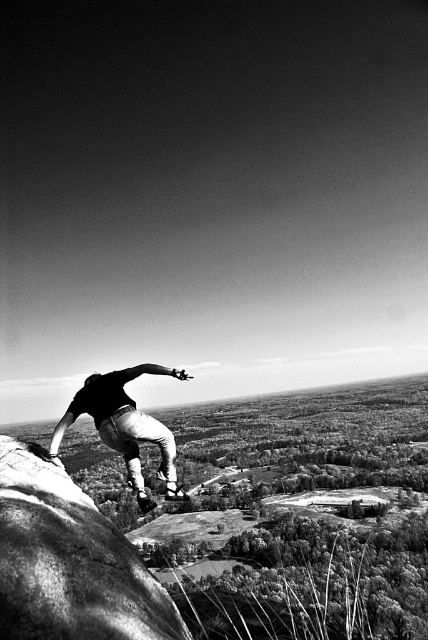
Who is more forward, (116, 394) or (137, 504)?

Point (116, 394) is more forward.

Can you confirm if smooth black skateboard at center is wider than metallic silver skateboard at lower center?

No.

Where is `smooth black skateboard at center`? Image resolution: width=428 pixels, height=640 pixels. smooth black skateboard at center is located at coordinates (124, 426).